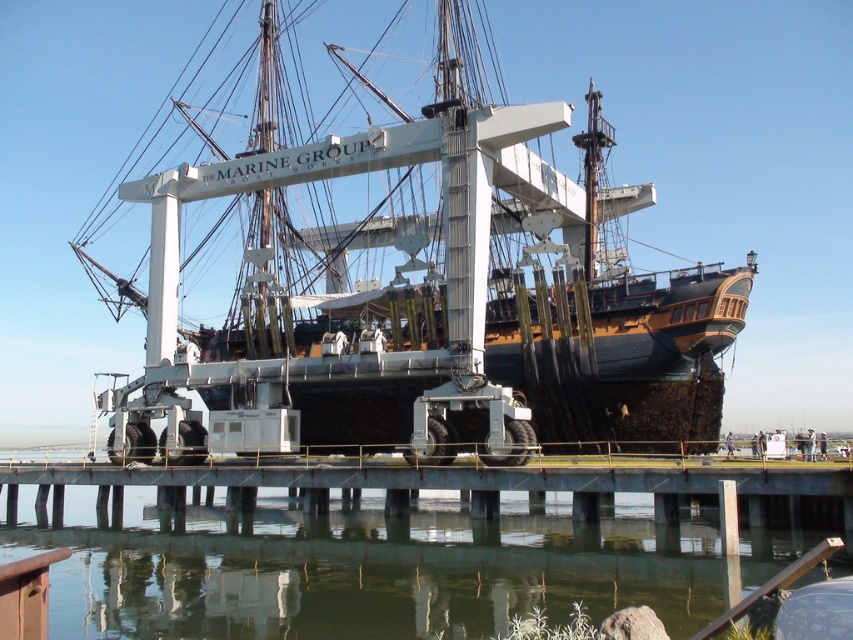
Question: Does wooden pirate ship at center have a larger size compared to greenish water at lower center?

Choices:
 (A) no
 (B) yes

Answer: (B)

Question: Does wooden pirate ship at center appear on the right side of greenish water at lower center?

Choices:
 (A) yes
 (B) no

Answer: (A)

Question: Does wooden pirate ship at center have a larger size compared to greenish water at lower center?

Choices:
 (A) yes
 (B) no

Answer: (A)

Question: Which of the following is the closest to the observer?

Choices:
 (A) (171, 540)
 (B) (265, 420)

Answer: (A)

Question: Which point appears farthest from the camera in this image?

Choices:
 (A) (434, 384)
 (B) (700, 586)

Answer: (A)

Question: Which point is closer to the camera taking this photo?

Choices:
 (A) (556, 435)
 (B) (115, 593)

Answer: (B)